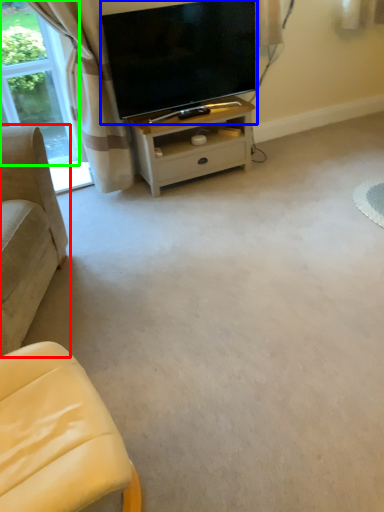
Question: Considering the real-world distances, which object is closest to studio couch (highlighted by a red box)? television (highlighted by a blue box) or bay window (highlighted by a green box).

Choices:
 (A) television
 (B) bay window

Answer: (A)